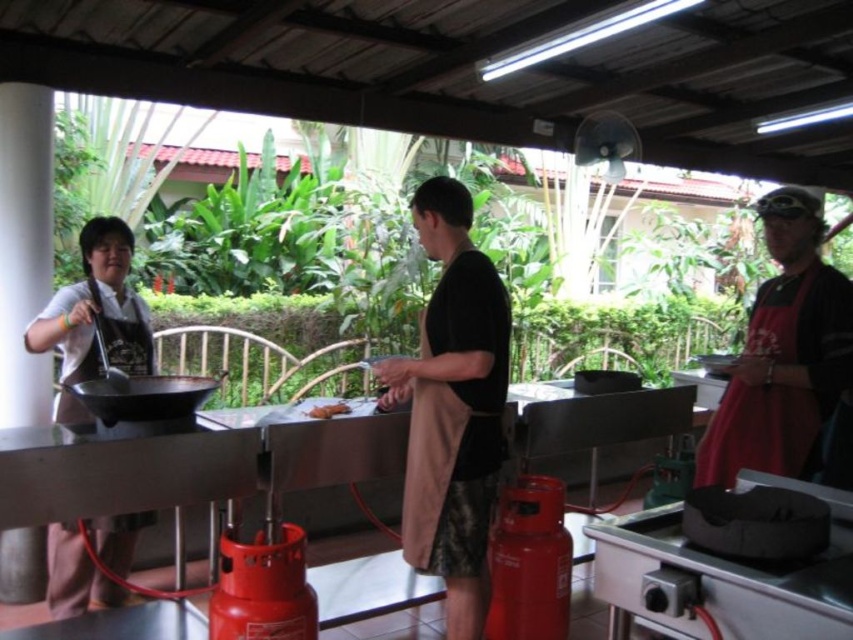
You are standing in the outdoor cooking area and want to hand a tool to the person wearing the red fabric shirt at right and the person holding the brown matte bread at center. Which one can you reach first without moving your position?

The red fabric shirt at right is closer to the viewer than the brown matte bread at center, so you can reach the person wearing the red fabric shirt at right first without moving your position.

You are a food delivery person who needs to deliver a hot meal to the person wearing the red fabric shirt at right without touching the black matte wok at left. The minimum safe distance to avoid splashing hot oil from the wok is 2 meters. Can you safely deliver the meal?

The red fabric shirt at right and black matte wok at left are 1.92 meters apart from each other. Since the required safe distance is 2 meters, the distance is insufficient. Therefore, delivering the meal might risk splashing hot oil from the wok.